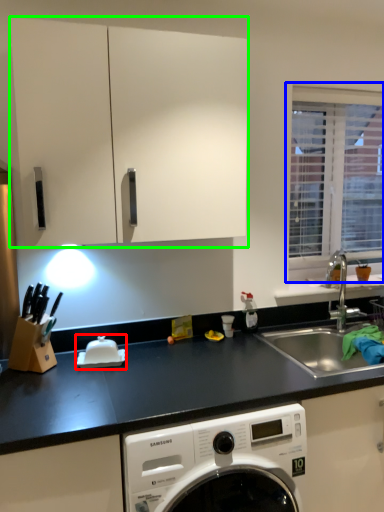
Question: Which object is positioned farthest from appliance (highlighted by a red box)? Select from window (highlighted by a blue box) and cabinetry (highlighted by a green box).

Choices:
 (A) window
 (B) cabinetry

Answer: (A)